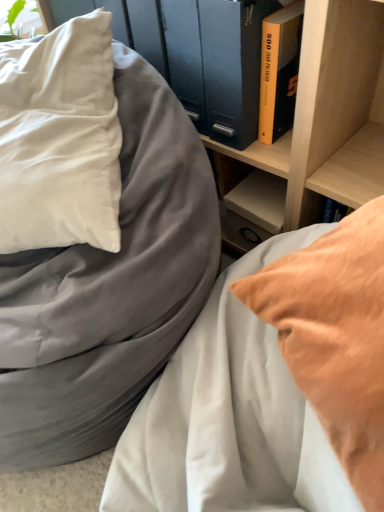
Question: Is wooden shelf at upper center positioned before white satin pillow at left?

Choices:
 (A) no
 (B) yes

Answer: (A)

Question: Considering the relative positions of wooden shelf at upper center and white satin pillow at left in the image provided, is wooden shelf at upper center to the left of white satin pillow at left from the viewer's perspective?

Choices:
 (A) no
 (B) yes

Answer: (A)

Question: Does wooden shelf at upper center have a lesser width compared to white satin pillow at left?

Choices:
 (A) yes
 (B) no

Answer: (B)

Question: Could you tell me if wooden shelf at upper center is turned towards white satin pillow at left?

Choices:
 (A) no
 (B) yes

Answer: (A)

Question: Is white satin pillow at left surrounded by wooden shelf at upper center?

Choices:
 (A) yes
 (B) no

Answer: (B)

Question: Is wooden shelf at upper center not within white satin pillow at left?

Choices:
 (A) yes
 (B) no

Answer: (A)

Question: Could yellow matte book at upper right be considered to be inside yellow hardcover book at upper right?

Choices:
 (A) no
 (B) yes

Answer: (A)

Question: Is yellow hardcover book at upper right smaller than yellow matte book at upper right?

Choices:
 (A) yes
 (B) no

Answer: (A)

Question: Can you confirm if yellow hardcover book at upper right is shorter than yellow matte book at upper right?

Choices:
 (A) yes
 (B) no

Answer: (A)

Question: Is there a large distance between yellow hardcover book at upper right and yellow matte book at upper right?

Choices:
 (A) yes
 (B) no

Answer: (B)

Question: Can you confirm if yellow hardcover book at upper right is positioned to the left of yellow matte book at upper right?

Choices:
 (A) no
 (B) yes

Answer: (A)

Question: From a real-world perspective, is yellow hardcover book at upper right located higher than yellow matte book at upper right?

Choices:
 (A) yes
 (B) no

Answer: (B)

Question: From a real-world perspective, is yellow hardcover book at upper right over matte gray bed at center, which is the first bed in left-to-right order?

Choices:
 (A) no
 (B) yes

Answer: (B)